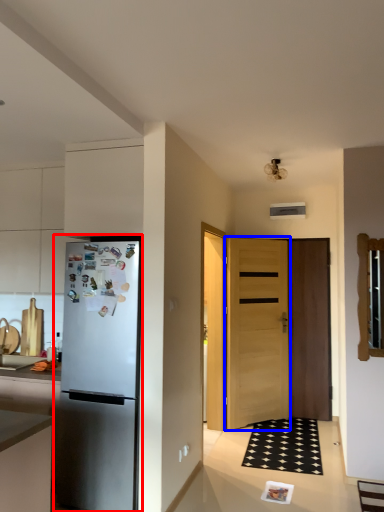
Question: Which of the following is the closest to the observer, refrigerator (highlighted by a red box) or door (highlighted by a blue box)?

Choices:
 (A) refrigerator
 (B) door

Answer: (A)